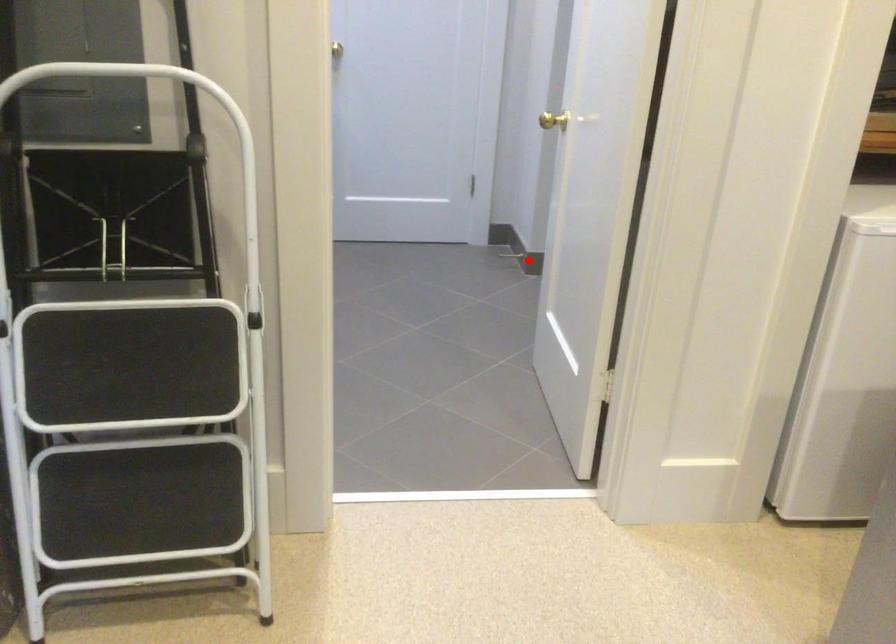
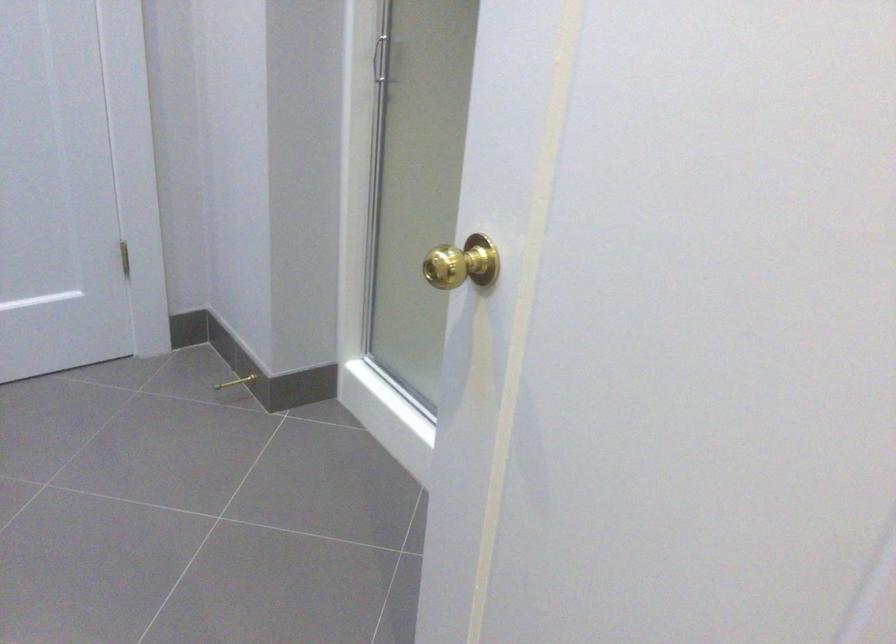
Question: I am providing you with two images of the same scene from different viewpoints. Image1 has a red point marked. In image2, the corresponding 3D location appears at what relative position? Reply with the corresponding letter.

Choices:
 (A) Closer
 (B) Farther

Answer: (A)